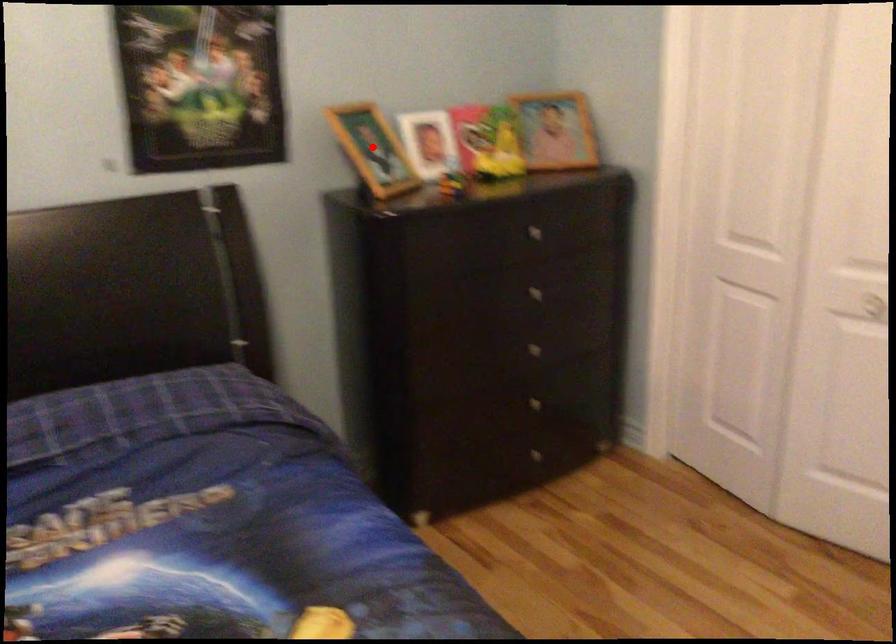
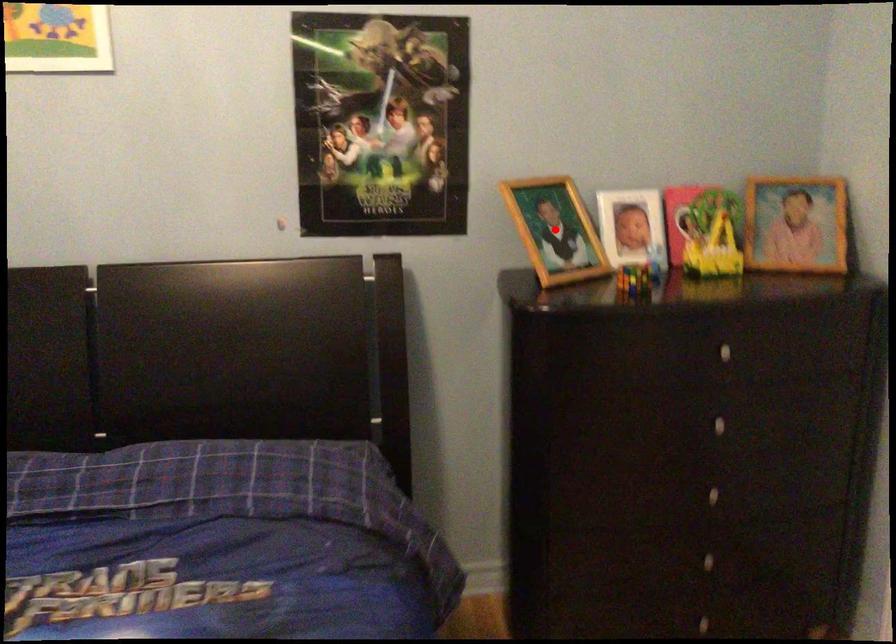
I am providing you with two images of the same scene from different viewpoints. A red point is marked on the first image and another point is marked on the second image. Do the highlighted points in image1 and image2 indicate the same real-world spot?

No